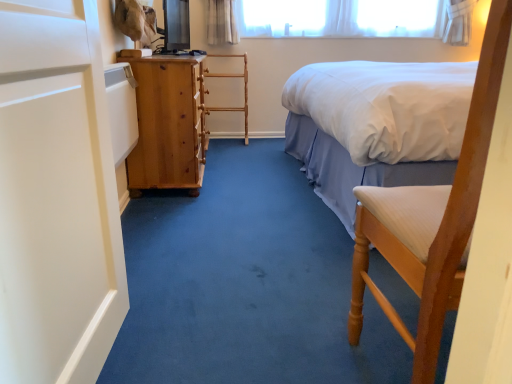
Question: Is white cotton bed at upper right in front of or behind white matte screen door at left in the image?

Choices:
 (A) front
 (B) behind

Answer: (B)

Question: Does point (423, 115) appear closer or farther from the camera than point (65, 261)?

Choices:
 (A) farther
 (B) closer

Answer: (A)

Question: Which of these objects is positioned farthest from the white matte screen door at left?

Choices:
 (A) wooden rack at center
 (B) wooden chair at right
 (C) white cotton bed at upper right
 (D) natural wood chest of drawers at left

Answer: (A)

Question: Which is nearer to the white matte screen door at left?

Choices:
 (A) white cotton bed at upper right
 (B) wooden chair at right
 (C) natural wood chest of drawers at left
 (D) wooden rack at center

Answer: (B)